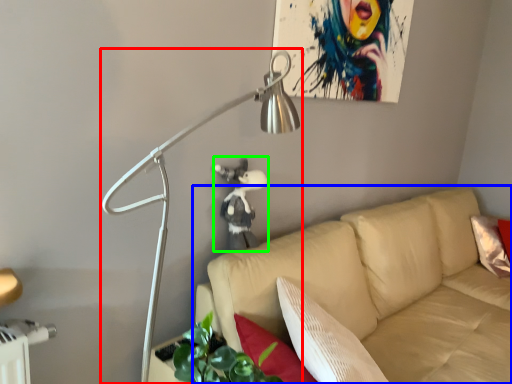
Question: Considering the real-world distances, which object is closest to lamp (highlighted by a red box)? studio couch (highlighted by a blue box) or person (highlighted by a green box).

Choices:
 (A) studio couch
 (B) person

Answer: (B)